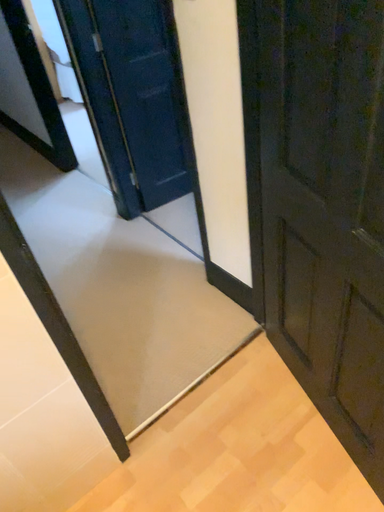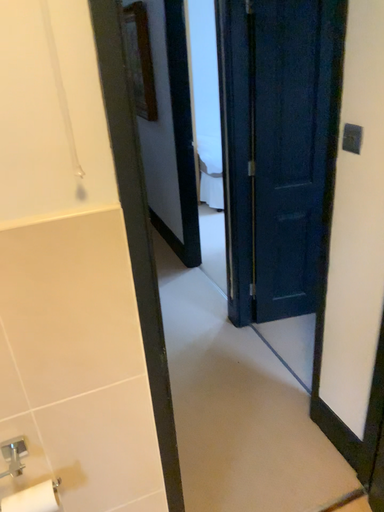
Question: Which way did the camera rotate in the video?

Choices:
 (A) rotated downward
 (B) rotated upward

Answer: (B)